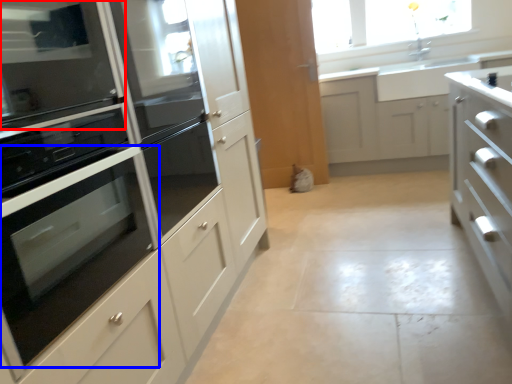
Question: Which object is further to the camera taking this photo, home appliance (highlighted by a red box) or oven (highlighted by a blue box)?

Choices:
 (A) home appliance
 (B) oven

Answer: (A)